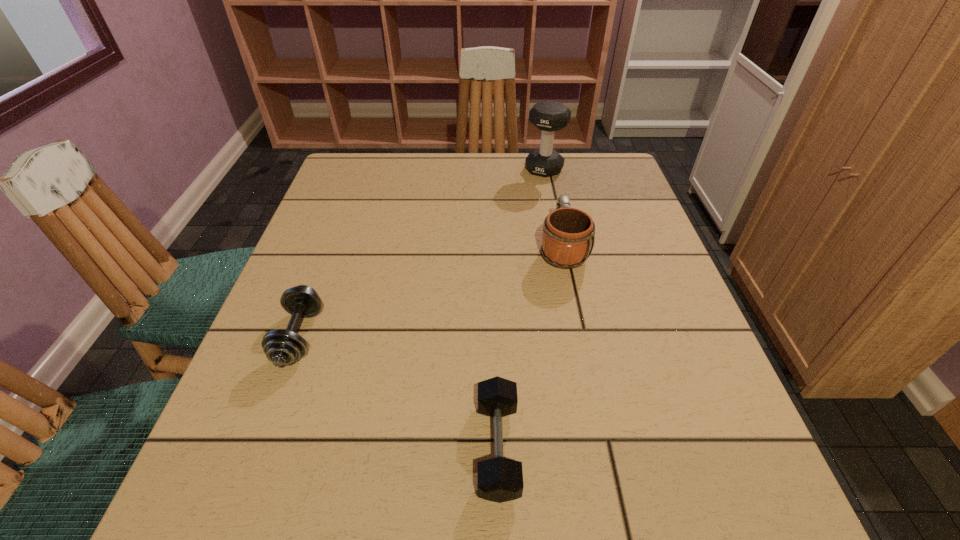
The image size is (960, 540). In order to click on free space located on the side of the mug with the handle in this screenshot , I will do `click(555, 211)`.

Identify the location of free space located on the side of the mug with the handle. (x=551, y=193).

You are a GUI agent. You are given a task and a screenshot of the screen. Output one action in this format:
    pyautogui.click(x=<x>, y=<y>)
    Task: Click on the free location located 0.100m on the back of the second nearest dumbbell
    
    Given the screenshot: What is the action you would take?
    pyautogui.click(x=324, y=267)

The height and width of the screenshot is (540, 960). I want to click on vacant space located 0.200m on the back of the second dumbbell from right to left, so click(x=493, y=307).

Identify the location of object that is at the far edge. The width and height of the screenshot is (960, 540). (549, 116).

The image size is (960, 540). In order to click on object present at the near edge in this screenshot , I will do `click(499, 479)`.

Locate an element on the screen. object that is at the left edge is located at coordinates [282, 347].

You are a GUI agent. You are given a task and a screenshot of the screen. Output one action in this format:
    pyautogui.click(x=<x>, y=<y>)
    Task: Click on the vacant space at the far edge
    This screenshot has height=540, width=960.
    Given the screenshot: What is the action you would take?
    pyautogui.click(x=413, y=153)

The image size is (960, 540). In order to click on vacant point at the near edge in this screenshot , I will do `click(316, 487)`.

Identify the location of vacant region at the left edge of the desktop. The image size is (960, 540). (305, 374).